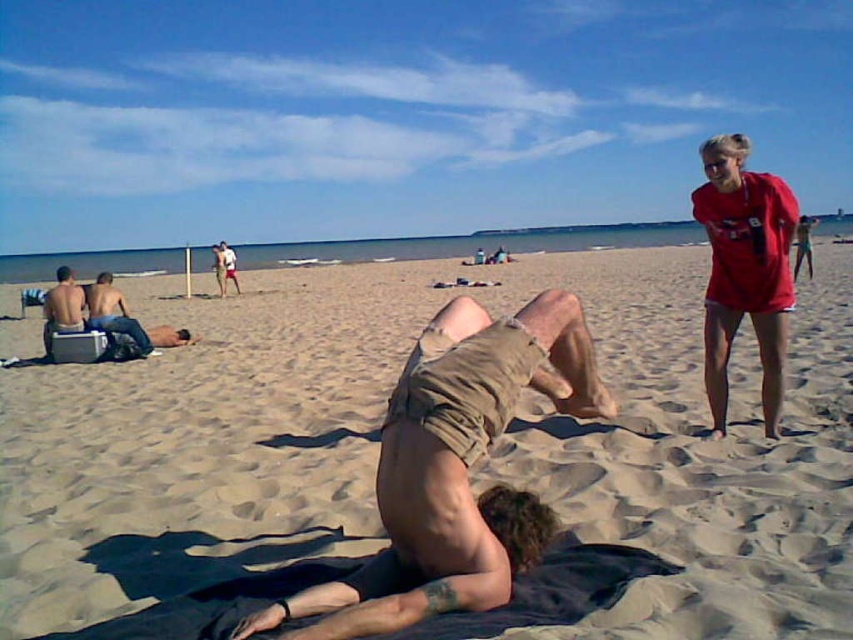
Question: Which point is farther from the camera taking this photo?

Choices:
 (A) (708, 614)
 (B) (227, 273)
 (C) (781, 280)

Answer: (B)

Question: Is brown cotton shorts at center smaller than light brown skin at center?

Choices:
 (A) yes
 (B) no

Answer: (A)

Question: Can you confirm if brown cotton shorts at center is thinner than smooth tan skin at center?

Choices:
 (A) no
 (B) yes

Answer: (B)

Question: Which point appears closest to the camera in this image?

Choices:
 (A) 454,528
 (B) 625,499
 (C) 767,362
 (D) 70,324

Answer: (A)

Question: Estimate the real-world distances between objects in this image. Which object is closer to the light brown skin at center?

Choices:
 (A) smooth tan skin at center
 (B) beige sand at center
 (C) brown cotton shorts at center

Answer: (B)

Question: Does smooth tan skin at center appear over matte khaki shorts at left?

Choices:
 (A) yes
 (B) no

Answer: (A)